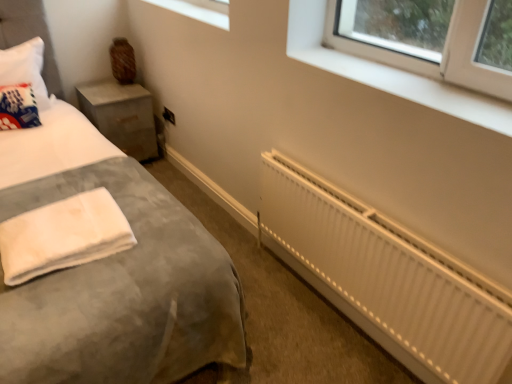
Question: Relative to white plastic window at upper right, marked as the first window in a front-to-back arrangement, is translucent glass window at upper center, which is the second window in bottom-to-top order, in front or behind?

Choices:
 (A) behind
 (B) front

Answer: (A)

Question: Which is correct: translucent glass window at upper center, marked as the 2th window in a front-to-back arrangement, is inside white plastic window at upper right, placed as the 2th window when sorted from top to bottom, or outside of it?

Choices:
 (A) outside
 (B) inside

Answer: (A)

Question: Which is farther from the velvet grey bed at lower left?

Choices:
 (A) concrete textured nightstand at left
 (B) white plastic window at upper right, marked as the first window in a front-to-back arrangement
 (C) white fabric throw pillow at left
 (D) translucent glass window at upper center, which is the second window in bottom-to-top order
 (E) white metallic radiator at lower right

Answer: (A)

Question: Which of these objects is positioned farthest from the white metallic radiator at lower right?

Choices:
 (A) velvet grey bed at lower left
 (B) white fluffy towel at lower left
 (C) concrete textured nightstand at left
 (D) translucent glass window at upper center, which appears as the 1th window when viewed from the left
 (E) white fabric throw pillow at left

Answer: (E)